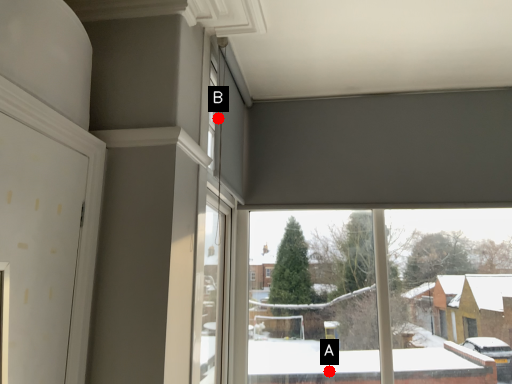
Question: Two points are circled on the image, labeled by A and B beside each circle. Which point is closer to the camera taking this photo?

Choices:
 (A) A is closer
 (B) B is closer

Answer: (B)